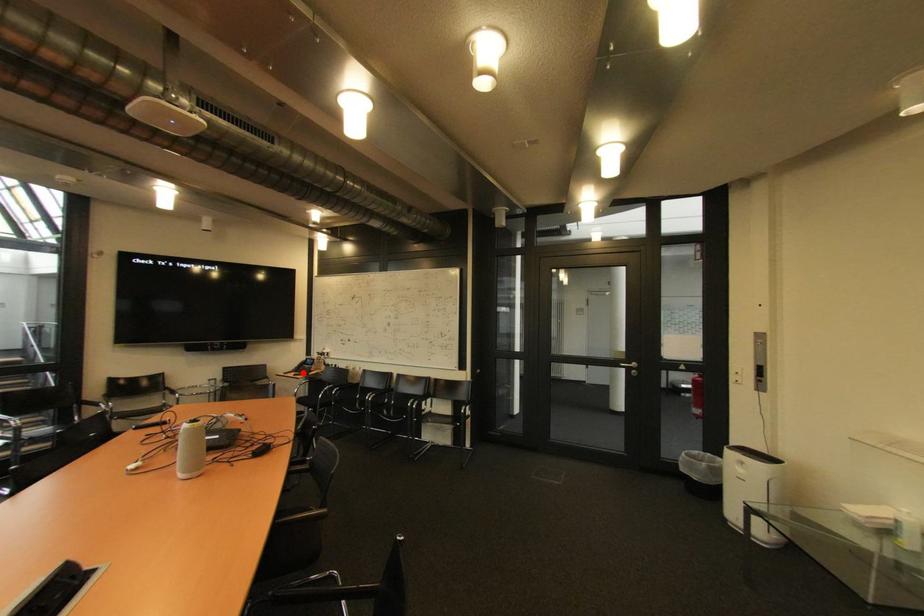
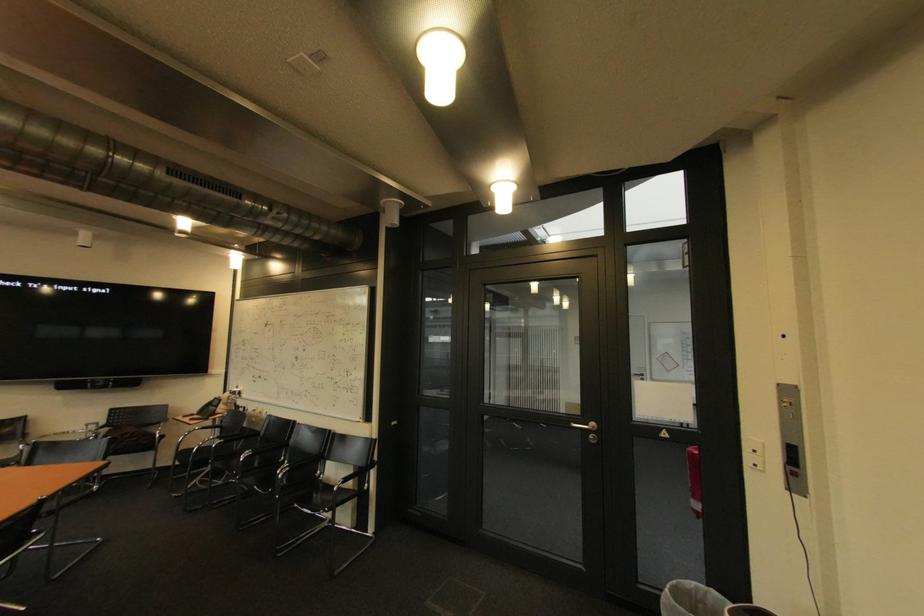
Question: I am providing you with two images of the same scene from different viewpoints. A red point is marked on the first image. At the location where the point appears in image 1, is it still visible in image 2?

Choices:
 (A) Yes
 (B) No

Answer: (A)